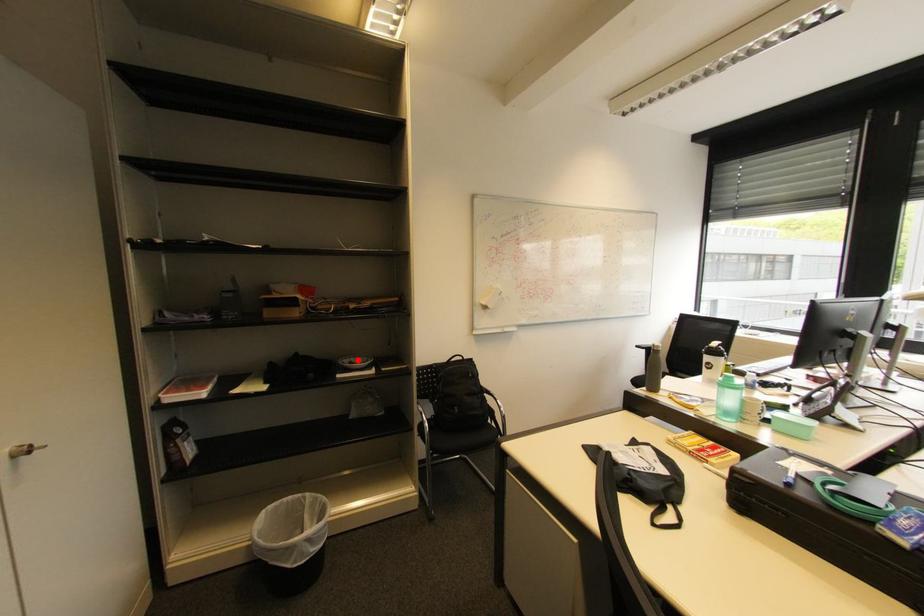
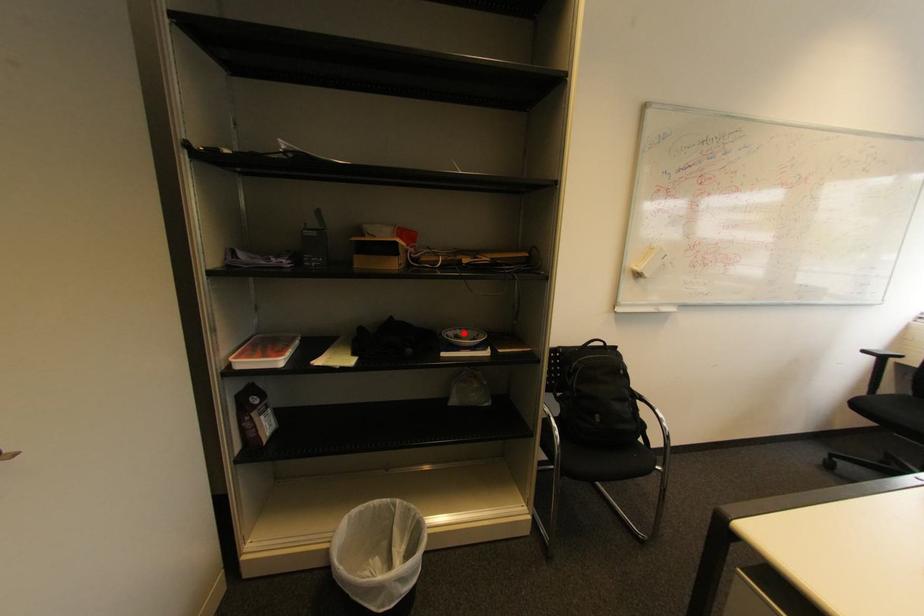
I am providing you with two images of the same scene from different viewpoints. A red point is marked on the first image and another point is marked on the second image. Is the red point in image1 aligned with the point shown in image2?

Yes